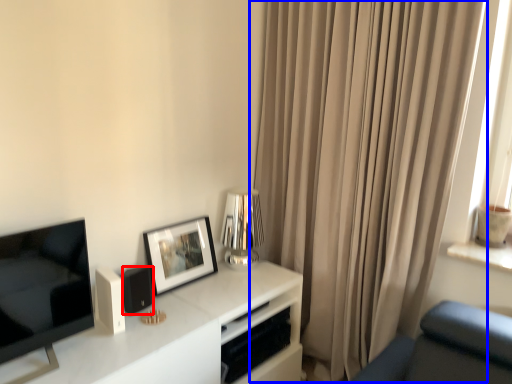
Question: Which object is closer to the camera taking this photo, speaker (highlighted by a red box) or curtain (highlighted by a blue box)?

Choices:
 (A) speaker
 (B) curtain

Answer: (B)